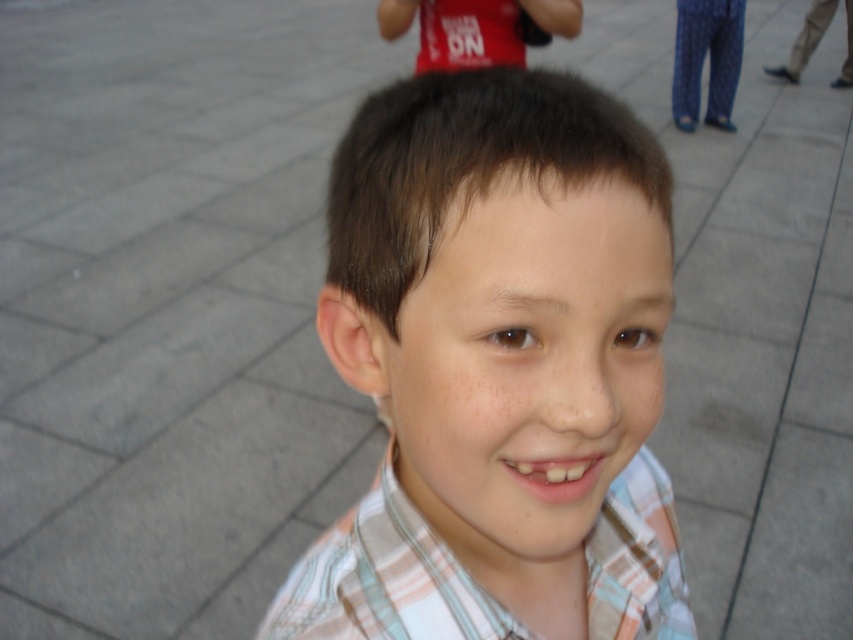
Is point (619, 568) closer to viewer compared to point (486, 60)?

Yes, point (619, 568) is in front of point (486, 60).

In the scene shown: Can you confirm if plaid cotton shirt at center is shorter than matte red shirt at upper center?

Yes, plaid cotton shirt at center is shorter than matte red shirt at upper center.

The width and height of the screenshot is (853, 640). What do you see at coordinates (384, 579) in the screenshot?
I see `plaid cotton shirt at center` at bounding box center [384, 579].

The image size is (853, 640). In order to click on plaid cotton shirt at center in this screenshot , I will do `click(384, 579)`.

Between point (315, 573) and point (350, 545), which one is positioned behind?

The point (315, 573) is more distant.

Between point (459, 614) and point (306, 604), which one is positioned in front?

Positioned in front is point (459, 614).

Where is `plaid shirt at center`? This screenshot has height=640, width=853. plaid shirt at center is located at coordinates (498, 368).

Is plaid shirt at center further to the viewer compared to matte red shirt at upper center?

No, plaid shirt at center is in front of matte red shirt at upper center.

Which of these two, plaid shirt at center or matte red shirt at upper center, stands shorter?

matte red shirt at upper center is shorter.

Is point (608, 205) positioned after point (457, 1)?

No, it is not.

Locate an element on the screen. Image resolution: width=853 pixels, height=640 pixels. plaid shirt at center is located at coordinates (498, 368).